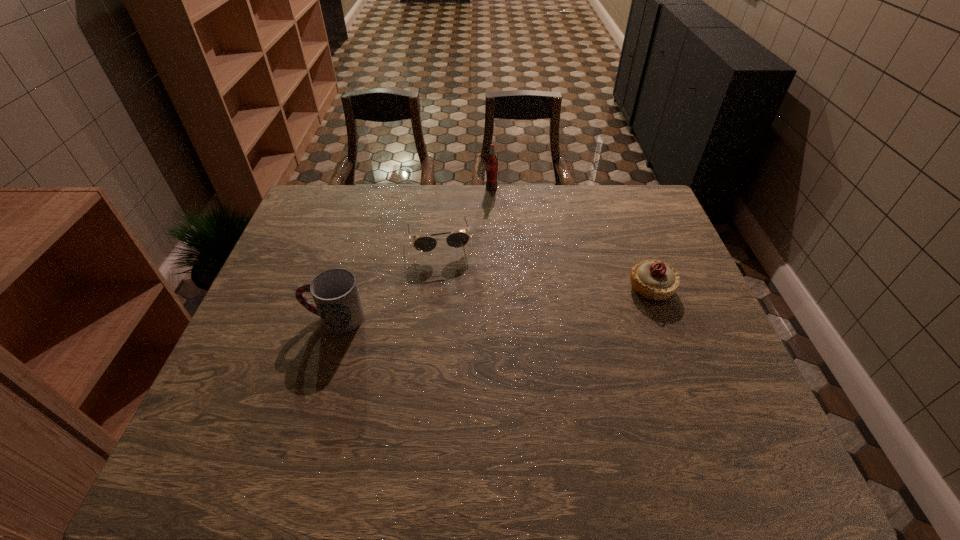
Identify the location of object positioned at the right edge. This screenshot has width=960, height=540. (652, 279).

At what (x,y) coordinates should I click in order to perform the action: click on free spot at the far edge of the desktop. Please return your answer as a coordinate pair (x, y). Looking at the image, I should click on (440, 206).

This screenshot has width=960, height=540. In the image, there is a desktop. Find the location of `vacant area at the right edge`. vacant area at the right edge is located at coordinates (724, 376).

You are a GUI agent. You are given a task and a screenshot of the screen. Output one action in this format:
    pyautogui.click(x=<x>, y=<y>)
    Task: Click on the vacant space at the far right corner of the desktop
    The height and width of the screenshot is (540, 960).
    Given the screenshot: What is the action you would take?
    pyautogui.click(x=640, y=213)

Image resolution: width=960 pixels, height=540 pixels. In order to click on free space between the soda bottle and the cup in this screenshot , I will do `click(413, 252)`.

Locate an element on the screen. This screenshot has height=540, width=960. free space between the third shortest object and the third nearest object is located at coordinates (387, 279).

Find the location of `blank region between the cup and the second object from right to left`. blank region between the cup and the second object from right to left is located at coordinates (413, 252).

This screenshot has height=540, width=960. Identify the location of empty space that is in between the rightmost object and the cup. (492, 302).

You are a GUI agent. You are given a task and a screenshot of the screen. Output one action in this format:
    pyautogui.click(x=<x>, y=<y>)
    Task: Click on the free space between the third object from left to right and the leftmost object
    
    Given the screenshot: What is the action you would take?
    pyautogui.click(x=413, y=252)

The image size is (960, 540). I want to click on vacant region between the tallest object and the pastry, so click(x=571, y=238).